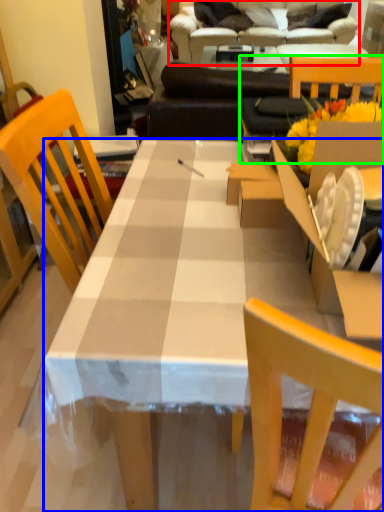
Question: Estimate the real-world distances between objects in this image. Which object is farther from studio couch (highlighted by a red box), desk (highlighted by a blue box) or chair (highlighted by a green box)?

Choices:
 (A) desk
 (B) chair

Answer: (A)